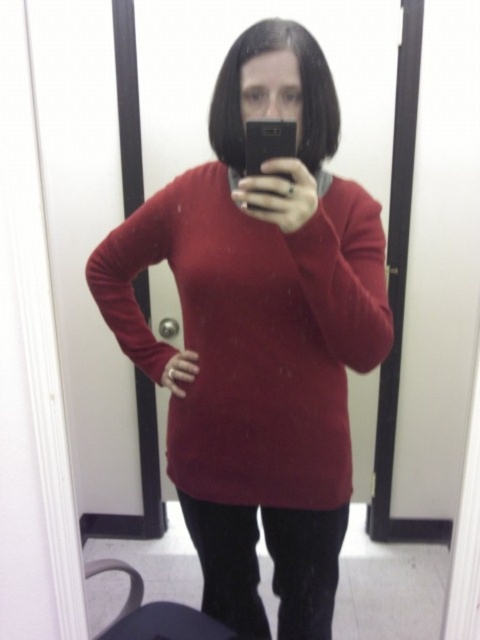
Is matte red sweater at center in front of black glossy phone at upper center?

That is False.

Locate an element on the screen. The width and height of the screenshot is (480, 640). matte red sweater at center is located at coordinates (254, 333).

Identify the location of matte red sweater at center. The height and width of the screenshot is (640, 480). (254, 333).

At what (x,y) coordinates should I click in order to perform the action: click on matte red sweater at center. Please return your answer as a coordinate pair (x, y). Image resolution: width=480 pixels, height=640 pixels. Looking at the image, I should click on pos(254,333).